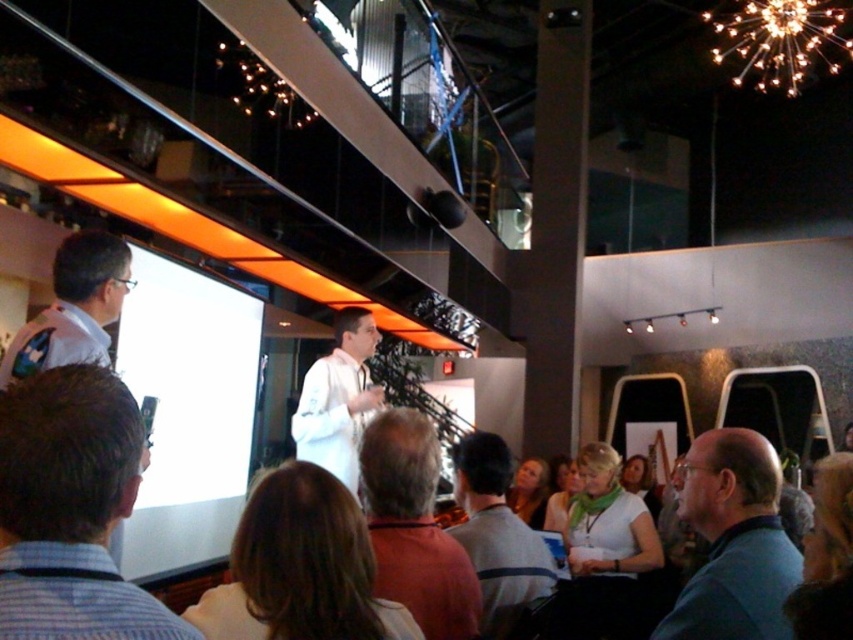
Question: Can you confirm if white shirt at center is bigger than blonde hair at center?

Choices:
 (A) yes
 (B) no

Answer: (A)

Question: Does brown hair at center appear under gray sweater at center?

Choices:
 (A) no
 (B) yes

Answer: (A)

Question: Which point is closer to the camera?

Choices:
 (A) reddish-brown hair at center
 (B) blonde hair at center

Answer: (A)

Question: Which object is closer to the camera taking this photo?

Choices:
 (A) light brown hair at lower center
 (B) dark brown hair at lower right
 (C) white shirt at center

Answer: (B)

Question: From the image, what is the correct spatial relationship of blue fabric shirt at lower right in relation to gray sweater at center?

Choices:
 (A) below
 (B) above

Answer: (B)

Question: Which object is the closest to the white shirt at center?

Choices:
 (A) brown hair at center
 (B) green fabric headscarf at lower center
 (C) blue striped shirt at center
 (D) gray sweater at center

Answer: (B)